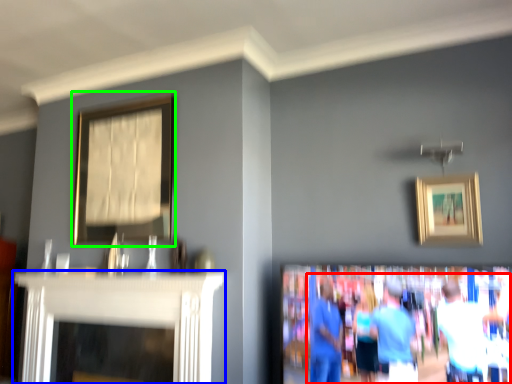
Question: Which object is the farthest from couple (highlighted by a red box)? Choose among these: fireplace (highlighted by a blue box) or picture frame (highlighted by a green box).

Choices:
 (A) fireplace
 (B) picture frame

Answer: (B)